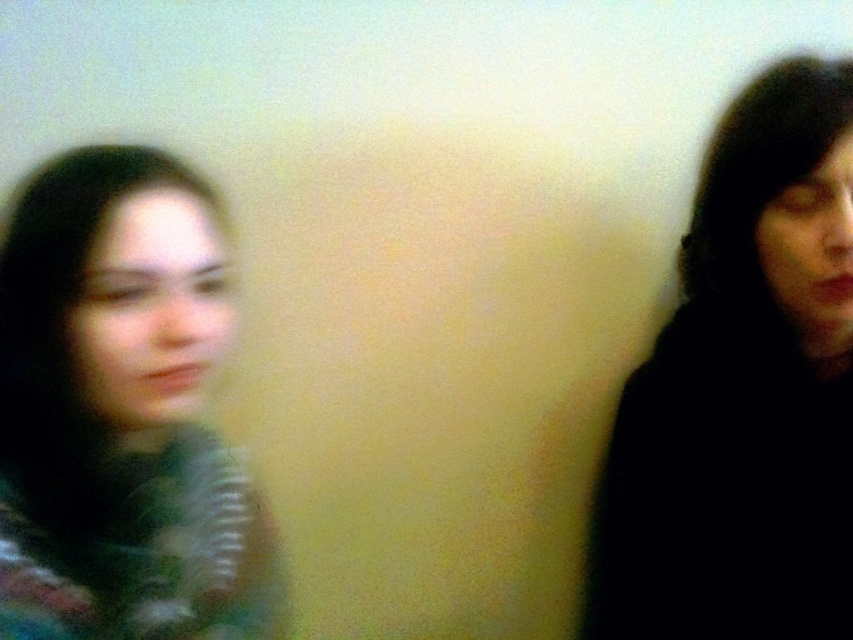
You are trying to determine the spatial relationship between the black matte hair at right and the matte green sweater at left in a blurry image. Based on the information provided, which object might have a greater width?

The black matte hair at right might be wider than the matte green sweater at left according to the description.